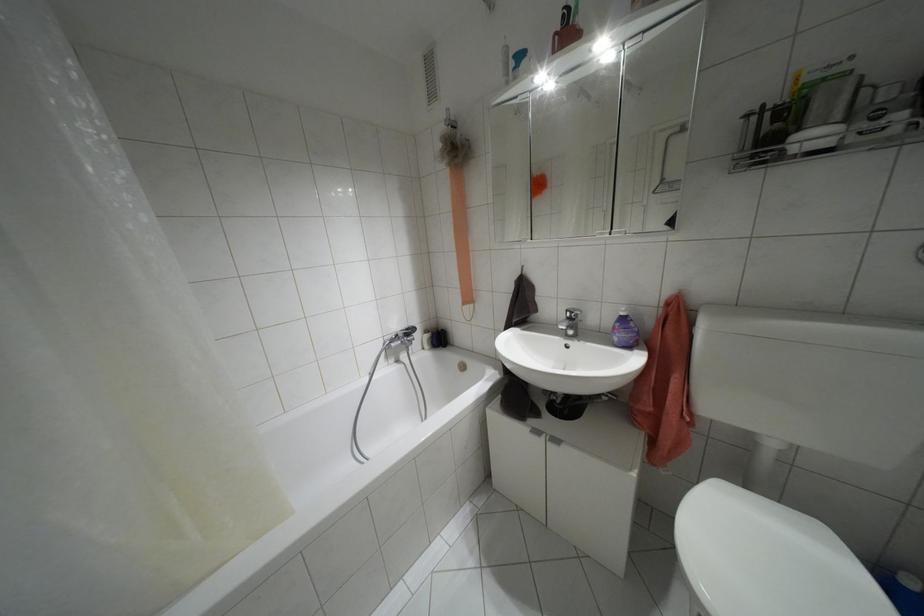
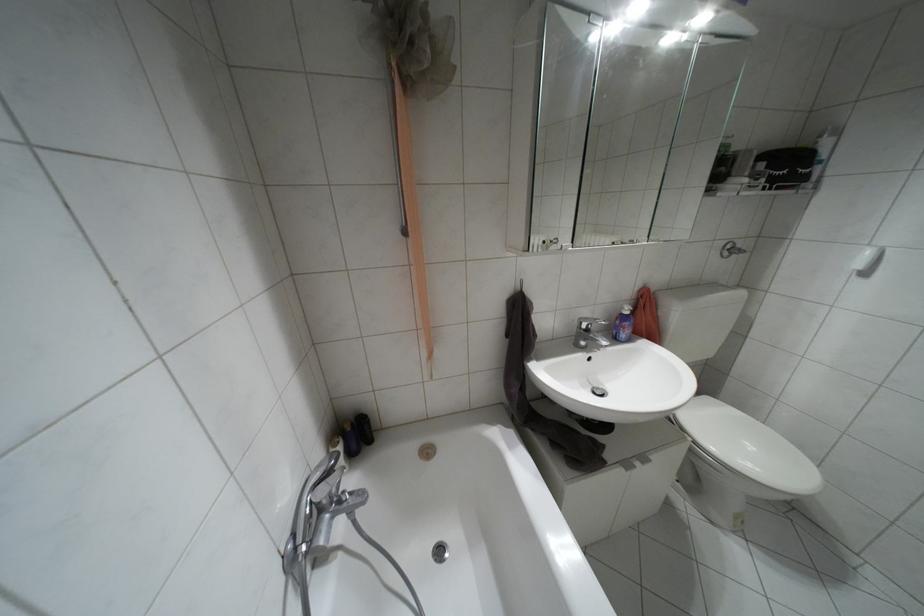
In the second image, find the point that corresponds to point 622,313 in the first image.

(626, 312)